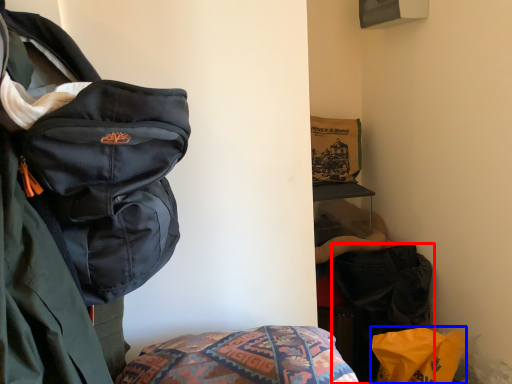
Question: Which object appears closest to the camera in this image, luggage and bags (highlighted by a red box) or material (highlighted by a blue box)?

Choices:
 (A) luggage and bags
 (B) material

Answer: (B)